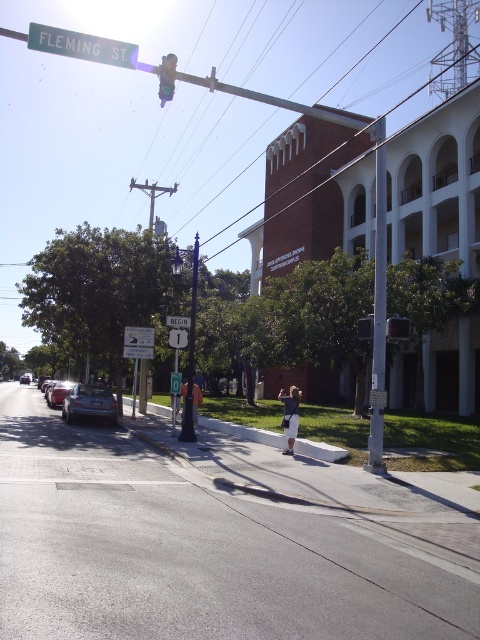
Is point (190, 342) closer to viewer compared to point (184, 397)?

No, (190, 342) is behind (184, 397).

Does metallic pole at center have a lesser width compared to dark blue jeans at center?

In fact, metallic pole at center might be wider than dark blue jeans at center.

You are a GUI agent. You are given a task and a screenshot of the screen. Output one action in this format:
    pyautogui.click(x=<x>, y=<y>)
    Task: Click on the metallic pole at center
    This screenshot has height=640, width=480.
    Given the screenshot: What is the action you would take?
    pyautogui.click(x=191, y=355)

The height and width of the screenshot is (640, 480). I want to click on metallic pole at center, so click(x=191, y=355).

Is green metallic street sign at upper center closer to the viewer compared to metallic traffic light at center?

Yes.

Does green metallic street sign at upper center have a greater width compared to metallic traffic light at center?

Indeed, green metallic street sign at upper center has a greater width compared to metallic traffic light at center.

Between point (62, 36) and point (391, 324), which one is positioned behind?

The point (391, 324) is more distant.

I want to click on green metallic street sign at upper center, so click(x=82, y=45).

Which is above, metallic pole at center or white plastic sign at upper center?

Positioned higher is metallic pole at center.

Is metallic pole at center wider than white plastic sign at upper center?

Yes.

Does point (195, 278) lie behind point (187, 326)?

That is False.

This screenshot has height=640, width=480. I want to click on metallic pole at center, so click(191, 355).